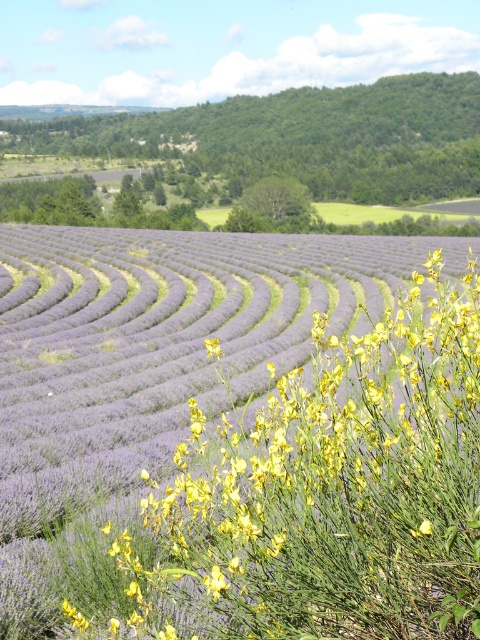
Based on the photo, is purple soft lavender at center bigger than green leafy hillside at upper center?

No, purple soft lavender at center is not bigger than green leafy hillside at upper center.

Is purple soft lavender at center to the left of green leafy hillside at upper center from the viewer's perspective?

Yes, purple soft lavender at center is to the left of green leafy hillside at upper center.

This screenshot has height=640, width=480. Find the location of `purple soft lavender at center`. purple soft lavender at center is located at coordinates (153, 358).